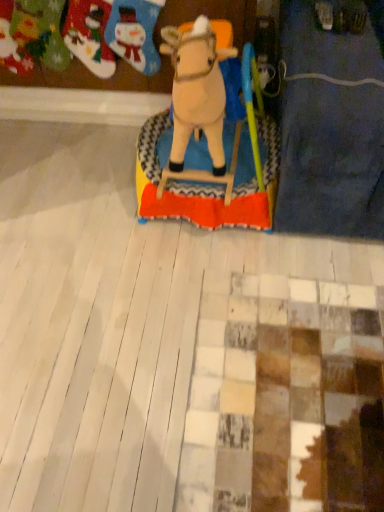
Where is `felt stocking at upper left, which is the 2th toy from left to right`? The width and height of the screenshot is (384, 512). felt stocking at upper left, which is the 2th toy from left to right is located at coordinates (134, 33).

Measure the distance between felt stocking at upper left, which is the 2th toy from left to right, and felt stockings at upper left, placed as the first toy when sorted from left to right.

felt stocking at upper left, which is the 2th toy from left to right, is 3.84 inches away from felt stockings at upper left, placed as the first toy when sorted from left to right.

From a real-world perspective, is felt stocking at upper left, arranged as the second toy when viewed from the right, on felt stockings at upper left, placed as the third toy when sorted from right to left?

Yes, from a real-world perspective, felt stocking at upper left, arranged as the second toy when viewed from the right, is over felt stockings at upper left, placed as the third toy when sorted from right to left

From the image's perspective, which is below, felt stocking at upper left, which is the 2th toy from left to right, or felt stockings at upper left, placed as the first toy when sorted from left to right?

felt stocking at upper left, which is the 2th toy from left to right.

This screenshot has height=512, width=384. I want to click on the 2nd toy to the left of the beige plush horse at center, the 3th toy in the left-to-right sequence, starting your count from the anchor, so click(89, 35).

Are beige plush horse at center, the 3th toy in the left-to-right sequence, and felt stockings at upper left, placed as the first toy when sorted from left to right, making contact?

No, beige plush horse at center, the 3th toy in the left-to-right sequence, is not touching felt stockings at upper left, placed as the first toy when sorted from left to right.

Does beige plush horse at center, the 3th toy in the left-to-right sequence, have a lesser width compared to felt stockings at upper left, placed as the first toy when sorted from left to right?

No, beige plush horse at center, the 3th toy in the left-to-right sequence, is not thinner than felt stockings at upper left, placed as the first toy when sorted from left to right.

Is felt stockings at upper left, placed as the third toy when sorted from right to left, far from felt stocking at upper left, which is the 2th toy from left to right?

No, felt stockings at upper left, placed as the third toy when sorted from right to left, is not far from felt stocking at upper left, which is the 2th toy from left to right.

From a real-world perspective, which is physically above, felt stockings at upper left, placed as the third toy when sorted from right to left, or felt stocking at upper left, arranged as the second toy when viewed from the right?

felt stocking at upper left, arranged as the second toy when viewed from the right, is physically above.

Considering the positions of point (101, 28) and point (126, 7), is point (101, 28) closer or farther from the camera than point (126, 7)?

Clearly, point (101, 28) is more distant from the camera than point (126, 7).

Considering the positions of objects felt stockings at upper left, placed as the first toy when sorted from left to right, and felt stocking at upper left, arranged as the second toy when viewed from the right, in the image provided, who is more to the right, felt stockings at upper left, placed as the first toy when sorted from left to right, or felt stocking at upper left, arranged as the second toy when viewed from the right,?

Positioned to the right is felt stocking at upper left, arranged as the second toy when viewed from the right.

From the picture: From the image's perspective, is felt stocking at upper left, which is the 2th toy from left to right, above or below beige plush horse at center, the 3th toy in the left-to-right sequence?

Based on their image positions, felt stocking at upper left, which is the 2th toy from left to right, is located above beige plush horse at center, the 3th toy in the left-to-right sequence.

Based on their sizes in the image, would you say felt stocking at upper left, which is the 2th toy from left to right, is bigger or smaller than beige plush horse at center, the 3th toy in the left-to-right sequence?

In the image, felt stocking at upper left, which is the 2th toy from left to right, appears to be smaller than beige plush horse at center, the 3th toy in the left-to-right sequence.

From a real-world perspective, is felt stocking at upper left, arranged as the second toy when viewed from the right, on beige plush horse at center, the 3th toy in the left-to-right sequence?

No, from a real-world perspective, felt stocking at upper left, arranged as the second toy when viewed from the right, is not above beige plush horse at center, the 3th toy in the left-to-right sequence.

Is felt stocking at upper left, which is the 2th toy from left to right, shorter than beige plush horse at center, which appears as the first toy when viewed from the right?

Indeed, felt stocking at upper left, which is the 2th toy from left to right, has a lesser height compared to beige plush horse at center, which appears as the first toy when viewed from the right.

Considering the sizes of objects felt stockings at upper left, placed as the third toy when sorted from right to left, and beige plush horse at center, the 3th toy in the left-to-right sequence, in the image provided, who is shorter, felt stockings at upper left, placed as the third toy when sorted from right to left, or beige plush horse at center, the 3th toy in the left-to-right sequence,?

With less height is felt stockings at upper left, placed as the third toy when sorted from right to left.

From the image's perspective, is felt stockings at upper left, placed as the first toy when sorted from left to right, under beige plush horse at center, the 3th toy in the left-to-right sequence?

No.

Consider the image. How different are the orientations of felt stockings at upper left, placed as the first toy when sorted from left to right, and beige plush horse at center, which appears as the first toy when viewed from the right, in degrees?

6.26 degrees separate the facing orientations of felt stockings at upper left, placed as the first toy when sorted from left to right, and beige plush horse at center, which appears as the first toy when viewed from the right.

Considering the positions of objects felt stockings at upper left, placed as the first toy when sorted from left to right, and beige plush horse at center, the 3th toy in the left-to-right sequence, in the image provided, who is more to the left, felt stockings at upper left, placed as the first toy when sorted from left to right, or beige plush horse at center, the 3th toy in the left-to-right sequence,?

felt stockings at upper left, placed as the first toy when sorted from left to right.

Considering the positions of objects beige plush horse at center, the 3th toy in the left-to-right sequence, and felt stocking at upper left, which is the 2th toy from left to right, in the image provided, who is more to the left, beige plush horse at center, the 3th toy in the left-to-right sequence, or felt stocking at upper left, which is the 2th toy from left to right,?

felt stocking at upper left, which is the 2th toy from left to right.

Based on the photo, is beige plush horse at center, the 3th toy in the left-to-right sequence, positioned far away from felt stocking at upper left, which is the 2th toy from left to right?

Actually, beige plush horse at center, the 3th toy in the left-to-right sequence, and felt stocking at upper left, which is the 2th toy from left to right, are a little close together.

Is beige plush horse at center, the 3th toy in the left-to-right sequence, facing towards felt stocking at upper left, which is the 2th toy from left to right?

No, beige plush horse at center, the 3th toy in the left-to-right sequence, does not turn towards felt stocking at upper left, which is the 2th toy from left to right.

From the image's perspective, which is below, beige plush horse at center, the 3th toy in the left-to-right sequence, or felt stocking at upper left, arranged as the second toy when viewed from the right?

beige plush horse at center, the 3th toy in the left-to-right sequence, appears lower in the image.

At what (x,y) coordinates should I click in order to perform the action: click on toy above the felt stocking at upper left, arranged as the second toy when viewed from the right (from the image's perspective). Please return your answer as a coordinate pair (x, y). Looking at the image, I should click on (89, 35).

The height and width of the screenshot is (512, 384). Find the location of `the 2nd toy in front of the felt stockings at upper left, placed as the first toy when sorted from left to right, counting from the anchor's position`. the 2nd toy in front of the felt stockings at upper left, placed as the first toy when sorted from left to right, counting from the anchor's position is located at coordinates (205, 141).

Which object lies further to the anchor point felt stocking at upper left, which is the 2th toy from left to right, beige plush horse at center, which appears as the first toy when viewed from the right, or felt stockings at upper left, placed as the first toy when sorted from left to right?

beige plush horse at center, which appears as the first toy when viewed from the right, is further to felt stocking at upper left, which is the 2th toy from left to right.

Consider the image. Considering their positions, is felt stockings at upper left, placed as the first toy when sorted from left to right, positioned closer to felt stocking at upper left, which is the 2th toy from left to right, than beige plush horse at center, which appears as the first toy when viewed from the right?

felt stockings at upper left, placed as the first toy when sorted from left to right, is positioned closer to the anchor felt stocking at upper left, which is the 2th toy from left to right.

Based on the photo, which object lies further to the anchor point felt stockings at upper left, placed as the third toy when sorted from right to left, felt stocking at upper left, arranged as the second toy when viewed from the right, or beige plush horse at center, which appears as the first toy when viewed from the right?

beige plush horse at center, which appears as the first toy when viewed from the right.

Which object lies further to the anchor point felt stockings at upper left, placed as the first toy when sorted from left to right, beige plush horse at center, which appears as the first toy when viewed from the right, or felt stocking at upper left, which is the 2th toy from left to right?

beige plush horse at center, which appears as the first toy when viewed from the right, lies further to felt stockings at upper left, placed as the first toy when sorted from left to right, than the other object.

Which object lies nearer to the anchor point beige plush horse at center, the 3th toy in the left-to-right sequence, felt stocking at upper left, which is the 2th toy from left to right, or felt stockings at upper left, placed as the third toy when sorted from right to left?

Based on the image, felt stocking at upper left, which is the 2th toy from left to right, appears to be nearer to beige plush horse at center, the 3th toy in the left-to-right sequence.

Considering their positions, is felt stockings at upper left, placed as the third toy when sorted from right to left, positioned further to beige plush horse at center, which appears as the first toy when viewed from the right, than felt stocking at upper left, arranged as the second toy when viewed from the right?

felt stockings at upper left, placed as the third toy when sorted from right to left, is further to beige plush horse at center, which appears as the first toy when viewed from the right.

Identify the location of toy between beige plush horse at center, which appears as the first toy when viewed from the right, and felt stockings at upper left, placed as the third toy when sorted from right to left, along the z-axis. This screenshot has width=384, height=512. (134, 33).